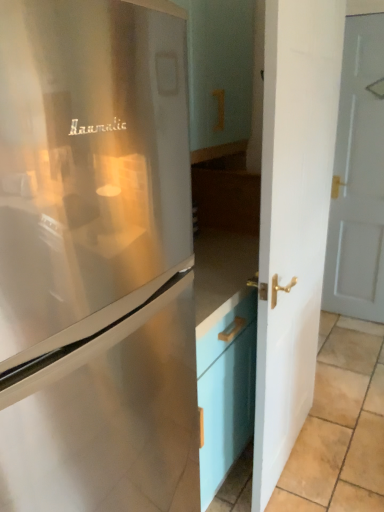
Question: Considering the relative positions of satin silver refrigerator at left and white glossy door at center, which appears as the first door when viewed from the left, in the image provided, is satin silver refrigerator at left to the left of white glossy door at center, which appears as the first door when viewed from the left, from the viewer's perspective?

Choices:
 (A) no
 (B) yes

Answer: (B)

Question: Is satin silver refrigerator at left further to the viewer compared to white glossy door at center, which appears as the first door when viewed from the left?

Choices:
 (A) no
 (B) yes

Answer: (A)

Question: Can you confirm if satin silver refrigerator at left is wider than white glossy door at center, marked as the second door in a right-to-left arrangement?

Choices:
 (A) yes
 (B) no

Answer: (A)

Question: Is satin silver refrigerator at left oriented towards white glossy door at center, positioned as the second door in back-to-front order?

Choices:
 (A) yes
 (B) no

Answer: (B)

Question: Does satin silver refrigerator at left have a larger size compared to white glossy door at center, the 1th door in the front-to-back sequence?

Choices:
 (A) yes
 (B) no

Answer: (A)

Question: Can you confirm if satin silver refrigerator at left is taller than white glossy door at center, positioned as the second door in back-to-front order?

Choices:
 (A) yes
 (B) no

Answer: (B)

Question: Considering the relative sizes of satin silver refrigerator at left and white painted wood door at right, marked as the 1th door in a back-to-front arrangement, in the image provided, is satin silver refrigerator at left wider than white painted wood door at right, marked as the 1th door in a back-to-front arrangement,?

Choices:
 (A) no
 (B) yes

Answer: (B)

Question: From a real-world perspective, is satin silver refrigerator at left positioned under white painted wood door at right, the second door from the left, based on gravity?

Choices:
 (A) yes
 (B) no

Answer: (A)

Question: Is white painted wood door at right, the second door from the left, a part of satin silver refrigerator at left?

Choices:
 (A) yes
 (B) no

Answer: (B)

Question: Does satin silver refrigerator at left have a lesser width compared to white painted wood door at right, marked as the 1th door in a back-to-front arrangement?

Choices:
 (A) yes
 (B) no

Answer: (B)

Question: Is satin silver refrigerator at left to the left of white painted wood door at right, the second door from the left, from the viewer's perspective?

Choices:
 (A) no
 (B) yes

Answer: (B)

Question: Can you confirm if satin silver refrigerator at left is positioned to the right of white painted wood door at right, which appears as the 1th door when viewed from the right?

Choices:
 (A) yes
 (B) no

Answer: (B)

Question: Is beige tile at lower right smaller than satin silver refrigerator at left?

Choices:
 (A) no
 (B) yes

Answer: (B)